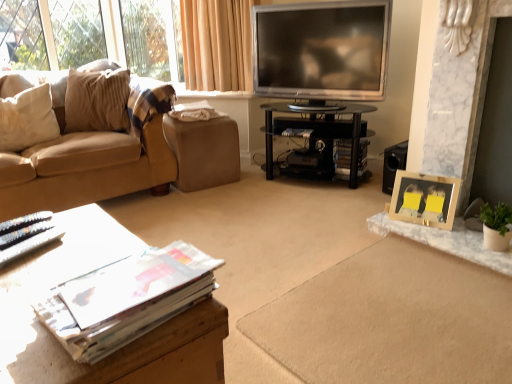
Question: Should I look upward or downward to see black glass tv stand at center, the first table positioned from the top?

Choices:
 (A) up
 (B) down

Answer: (A)

Question: From the image's perspective, is matte paper magazine at center, acting as the third magazine starting from the bottom, under white glossy magazine at lower left, the third magazine when ordered from top to bottom?

Choices:
 (A) yes
 (B) no

Answer: (B)

Question: Does matte paper magazine at center, acting as the third magazine starting from the bottom, have a greater height compared to white glossy magazine at lower left, the 1th magazine positioned from the front?

Choices:
 (A) yes
 (B) no

Answer: (B)

Question: Is matte paper magazine at center, the 2th magazine from the right, outside white glossy magazine at lower left, the 3th magazine positioned from the right?

Choices:
 (A) yes
 (B) no

Answer: (A)

Question: Is matte paper magazine at center, arranged as the 2th magazine when viewed from the front, positioned behind white glossy magazine at lower left, the third magazine when ordered from top to bottom?

Choices:
 (A) no
 (B) yes

Answer: (B)

Question: From the image's perspective, is matte paper magazine at center, the 2th magazine from the right, over white glossy magazine at lower left, positioned as the first magazine in left-to-right order?

Choices:
 (A) yes
 (B) no

Answer: (A)

Question: Considering the relative positions of matte paper magazine at center, positioned as the 1th magazine in top-to-bottom order, and white glossy magazine at lower left, arranged as the 3th magazine when viewed from the back, in the image provided, is matte paper magazine at center, positioned as the 1th magazine in top-to-bottom order, in front of white glossy magazine at lower left, arranged as the 3th magazine when viewed from the back,?

Choices:
 (A) yes
 (B) no

Answer: (B)

Question: Is brown leather footrest at center inside matte paper magazine at center, which ranks as the second magazine in back-to-front order?

Choices:
 (A) no
 (B) yes

Answer: (A)

Question: Can you confirm if matte paper magazine at center, arranged as the 2th magazine when viewed from the front, is bigger than brown leather footrest at center?

Choices:
 (A) yes
 (B) no

Answer: (B)

Question: Considering the relative sizes of matte paper magazine at center, arranged as the 2th magazine when viewed from the front, and brown leather footrest at center in the image provided, is matte paper magazine at center, arranged as the 2th magazine when viewed from the front, taller than brown leather footrest at center?

Choices:
 (A) yes
 (B) no

Answer: (B)

Question: Is matte paper magazine at center, which is the second magazine from left to right, smaller than brown leather footrest at center?

Choices:
 (A) yes
 (B) no

Answer: (A)

Question: Is matte paper magazine at center, acting as the third magazine starting from the bottom, at the right side of brown leather footrest at center?

Choices:
 (A) yes
 (B) no

Answer: (A)

Question: Does wooden table at lower left, which is the 1th table from front to back, have a lesser height compared to matte paper magazine at center, which appears as the 1th magazine when viewed from the back?

Choices:
 (A) yes
 (B) no

Answer: (B)